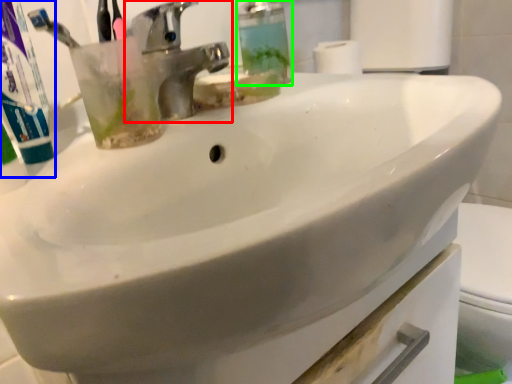
Question: Which is farther away from tap (highlighted by a red box)? toothpaste (highlighted by a blue box) or soap dispenser (highlighted by a green box)?

Choices:
 (A) toothpaste
 (B) soap dispenser

Answer: (A)